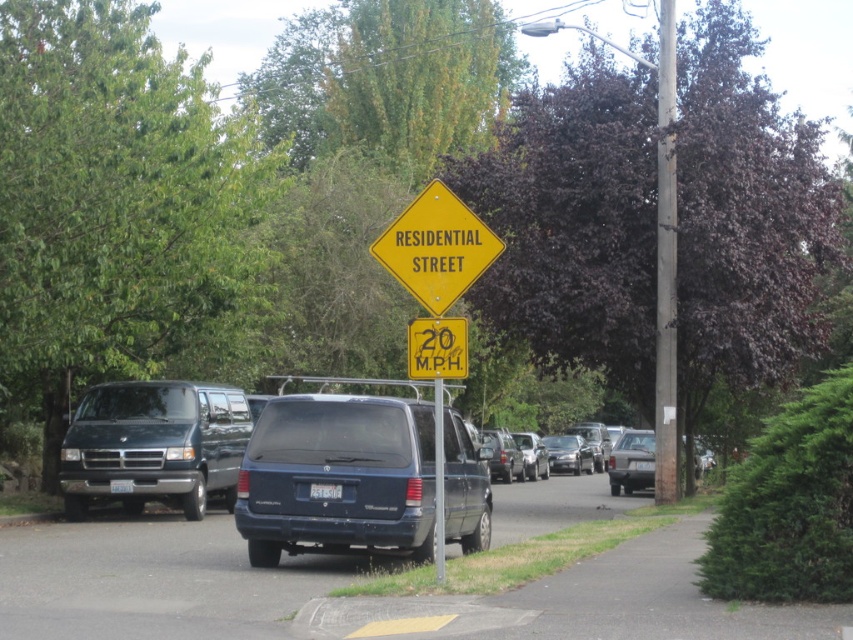
Which is more to the left, metallic gray pole at right or yellow plastic speed limit sign at center?

yellow plastic speed limit sign at center is more to the left.

Between metallic gray pole at right and yellow plastic speed limit sign at center, which one has more height?

metallic gray pole at right

This screenshot has width=853, height=640. What do you see at coordinates (665, 264) in the screenshot?
I see `metallic gray pole at right` at bounding box center [665, 264].

Locate an element on the screen. metallic gray pole at right is located at coordinates (665, 264).

Is matte black van at left to the right of satin silver sedan at center from the viewer's perspective?

In fact, matte black van at left is to the left of satin silver sedan at center.

Who is shorter, matte black van at left or satin silver sedan at center?

Standing shorter between the two is satin silver sedan at center.

Is point (204, 417) positioned behind point (578, 449)?

No, (204, 417) is closer to viewer.

Image resolution: width=853 pixels, height=640 pixels. Find the location of `matte black van at left`. matte black van at left is located at coordinates (154, 445).

Does matte black van at left have a larger size compared to yellow diamond-shaped sign at center?

Yes.

Which of these two, matte black van at left or yellow diamond-shaped sign at center, stands taller?

Standing taller between the two is matte black van at left.

Between point (206, 486) and point (434, 285), which one is positioned behind?

The point (206, 486) is more distant.

At what (x,y) coordinates should I click in order to perform the action: click on matte black van at left. Please return your answer as a coordinate pair (x, y). Image resolution: width=853 pixels, height=640 pixels. Looking at the image, I should click on (154, 445).